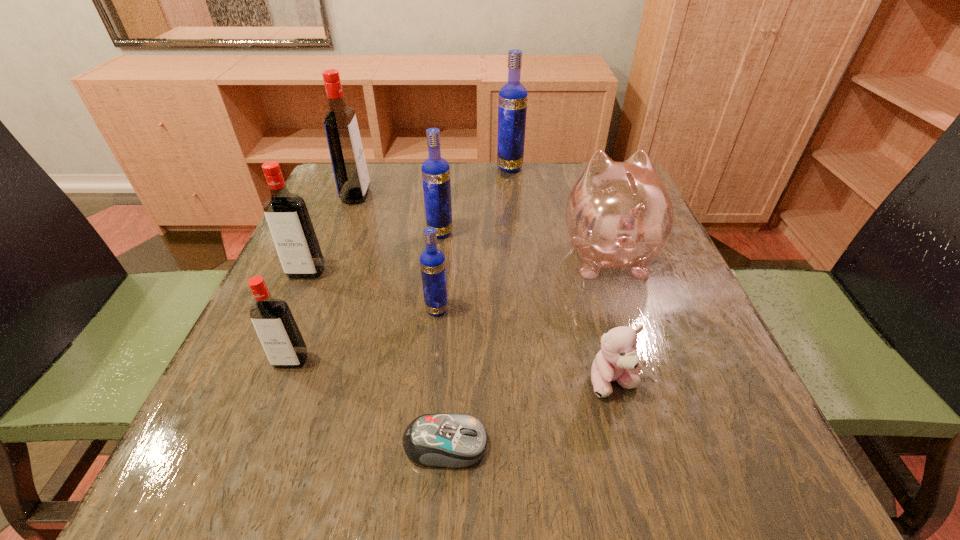
You are a GUI agent. You are given a task and a screenshot of the screen. Output one action in this format:
    pyautogui.click(x=<x>, y=<y>)
    Task: Click on the smallest blue vodka
    The width and height of the screenshot is (960, 540).
    Given the screenshot: What is the action you would take?
    [x=432, y=261]

You are a GUI agent. You are given a task and a screenshot of the screen. Output one action in this format:
    pyautogui.click(x=<x>, y=<y>)
    Task: Click on the nearest red vodka
    This screenshot has width=960, height=540.
    Given the screenshot: What is the action you would take?
    tap(280, 337)

This screenshot has height=540, width=960. Find the location of `the smallest red vodka`. the smallest red vodka is located at coordinates (280, 337).

I want to click on pink teddy bear, so click(617, 361).

At what (x,y) coordinates should I click in order to perform the action: click on the second shortest object. Please return your answer as a coordinate pair (x, y). This screenshot has width=960, height=540. Looking at the image, I should click on (617, 361).

At what (x,y) coordinates should I click in order to perform the action: click on the nearest object. Please return your answer as a coordinate pair (x, y). The width and height of the screenshot is (960, 540). Looking at the image, I should click on (450, 440).

Locate an element on the screen. computer mouse is located at coordinates (450, 440).

The image size is (960, 540). I want to click on vacant space located 0.320m on the front of the rightmost blue vodka, so click(x=517, y=247).

The height and width of the screenshot is (540, 960). I want to click on vacant space located 0.060m on the front and back of the eighth nearest object, so click(393, 195).

The image size is (960, 540). I want to click on free location located on the front of the second farthest blue vodka, so (422, 386).